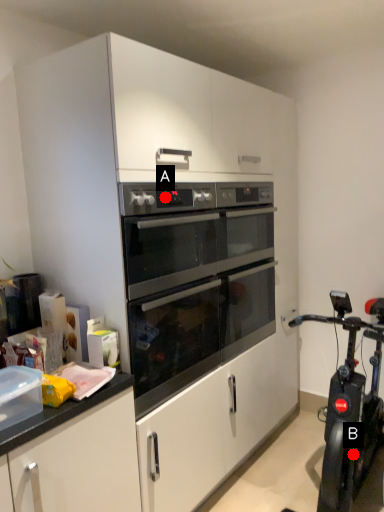
Question: Two points are circled on the image, labeled by A and B beside each circle. Which point is farther from the camera taking this photo?

Choices:
 (A) A is further
 (B) B is further

Answer: (B)